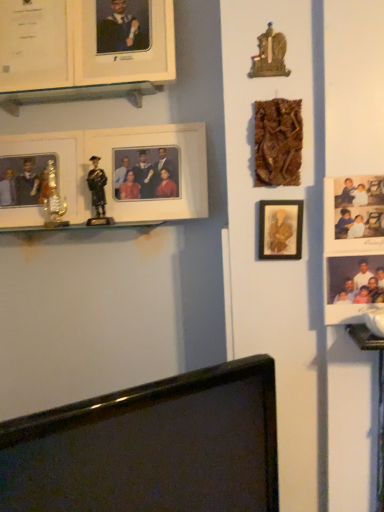
Question: Can you confirm if matte black figure at left is smaller than metallic gold trophy at left, marked as the 6th picture frame in a front-to-back arrangement?

Choices:
 (A) no
 (B) yes

Answer: (B)

Question: Is matte black figure at left positioned beyond the bounds of metallic gold trophy at left, which is counted as the 1th picture frame, starting from the back?

Choices:
 (A) no
 (B) yes

Answer: (B)

Question: From a real-world perspective, is matte black figure at left on top of metallic gold trophy at left, marked as the 6th picture frame in a front-to-back arrangement?

Choices:
 (A) no
 (B) yes

Answer: (A)

Question: Does matte black figure at left come in front of metallic gold trophy at left, marked as the 6th picture frame in a front-to-back arrangement?

Choices:
 (A) no
 (B) yes

Answer: (B)

Question: Does matte black figure at left have a greater height compared to metallic gold trophy at left, which is counted as the 1th picture frame, starting from the back?

Choices:
 (A) yes
 (B) no

Answer: (B)

Question: Which is correct: matte white picture frame at upper left, arranged as the 4th picture frame when viewed from the back, is inside matte gold picture frame at center-right, which appears as the second picture frame when viewed from the front, or outside of it?

Choices:
 (A) outside
 (B) inside

Answer: (A)

Question: In the image, is matte white picture frame at upper left, acting as the 3th picture frame starting from the front, on the left side or the right side of matte gold picture frame at center-right, which ranks as the fifth picture frame in back-to-front order?

Choices:
 (A) right
 (B) left

Answer: (B)

Question: Does point (0, 16) appear closer or farther from the camera than point (268, 244)?

Choices:
 (A) closer
 (B) farther

Answer: (B)

Question: In terms of width, does matte white picture frame at upper left, arranged as the 4th picture frame when viewed from the back, look wider or thinner when compared to matte gold picture frame at center-right, which ranks as the fifth picture frame in back-to-front order?

Choices:
 (A) thin
 (B) wide

Answer: (B)

Question: Considering the positions of metallic gold trophy at left, which is counted as the 1th picture frame, starting from the back, and white matte picture frame at upper left, acting as the fifth picture frame starting from the front, in the image, is metallic gold trophy at left, which is counted as the 1th picture frame, starting from the back, bigger or smaller than white matte picture frame at upper left, acting as the fifth picture frame starting from the front,?

Choices:
 (A) small
 (B) big

Answer: (A)

Question: Is point (29, 137) positioned closer to the camera than point (54, 208)?

Choices:
 (A) closer
 (B) farther

Answer: (B)

Question: Visually, is metallic gold trophy at left, which is counted as the 1th picture frame, starting from the back, positioned to the left or to the right of white matte picture frame at upper left, acting as the fifth picture frame starting from the front?

Choices:
 (A) right
 (B) left

Answer: (B)

Question: From their relative heights in the image, would you say metallic gold trophy at left, marked as the 6th picture frame in a front-to-back arrangement, is taller or shorter than white matte picture frame at upper left, acting as the fifth picture frame starting from the front?

Choices:
 (A) short
 (B) tall

Answer: (A)

Question: Considering the positions of matte black figure at left and white matte picture frame at upper left, which is counted as the 3th picture frame, starting from the back, in the image, is matte black figure at left wider or thinner than white matte picture frame at upper left, which is counted as the 3th picture frame, starting from the back,?

Choices:
 (A) wide
 (B) thin

Answer: (B)

Question: In the image, is matte black figure at left positioned in front of or behind white matte picture frame at upper left, the fourth picture frame positioned from the front?

Choices:
 (A) front
 (B) behind

Answer: (B)